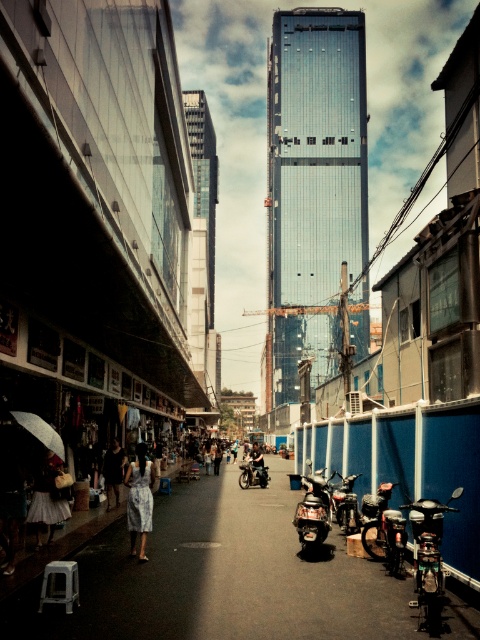
Question: Which object is farther from the camera taking this photo?

Choices:
 (A) shiny chrome scooter at center
 (B) printed fabric dress at center

Answer: (A)

Question: Is matte white dress at lower left to the right of light blue dress at center from the viewer's perspective?

Choices:
 (A) yes
 (B) no

Answer: (A)

Question: From the image, what is the correct spatial relationship of matte black scooter at center in relation to printed fabric dress at center?

Choices:
 (A) right
 (B) left

Answer: (A)

Question: Which of the following is the farthest from the observer?

Choices:
 (A) (x=300, y=508)
 (B) (x=131, y=484)
 (C) (x=253, y=474)
 (D) (x=112, y=465)

Answer: (C)

Question: Is shiny chrome scooter at center positioned before shiny black motorcycle at center?

Choices:
 (A) no
 (B) yes

Answer: (B)

Question: Which point is farther to the camera?

Choices:
 (A) (110, 481)
 (B) (312, 476)
 (C) (264, 472)

Answer: (C)